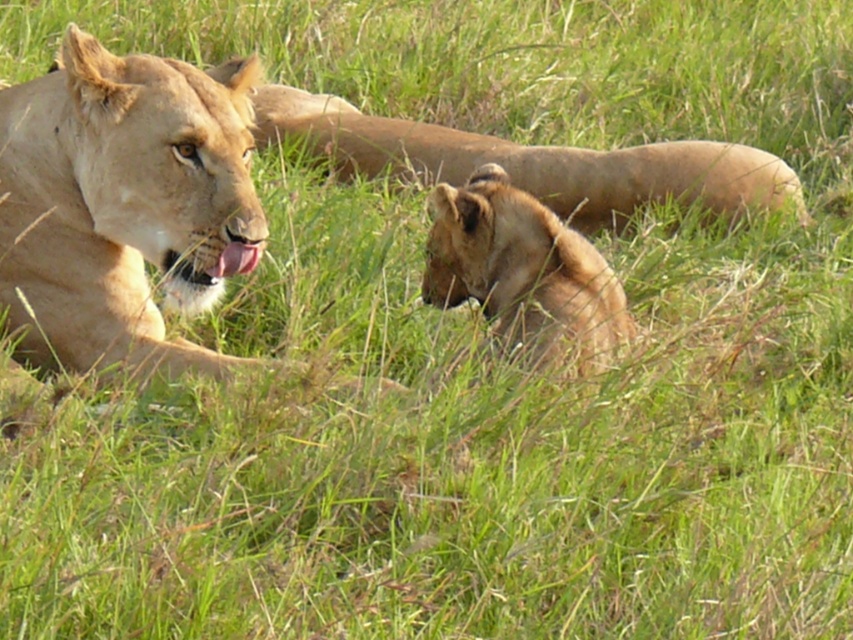
Question: Is golden fur lion at center smaller than golden fur lion cub at center?

Choices:
 (A) no
 (B) yes

Answer: (A)

Question: Does light brown fur lion at left have a greater width compared to golden fur lion at center?

Choices:
 (A) no
 (B) yes

Answer: (A)

Question: Which of these objects is positioned farthest from the golden fur lion at center?

Choices:
 (A) golden fur lion cub at center
 (B) light brown fur lion at left

Answer: (B)

Question: Which point appears closest to the camera in this image?

Choices:
 (A) (527, 164)
 (B) (193, 202)

Answer: (B)

Question: Is light brown fur lion at left closer to camera compared to golden fur lion cub at center?

Choices:
 (A) no
 (B) yes

Answer: (B)

Question: Which point appears farthest from the camera in this image?

Choices:
 (A) (399, 120)
 (B) (569, 230)

Answer: (A)